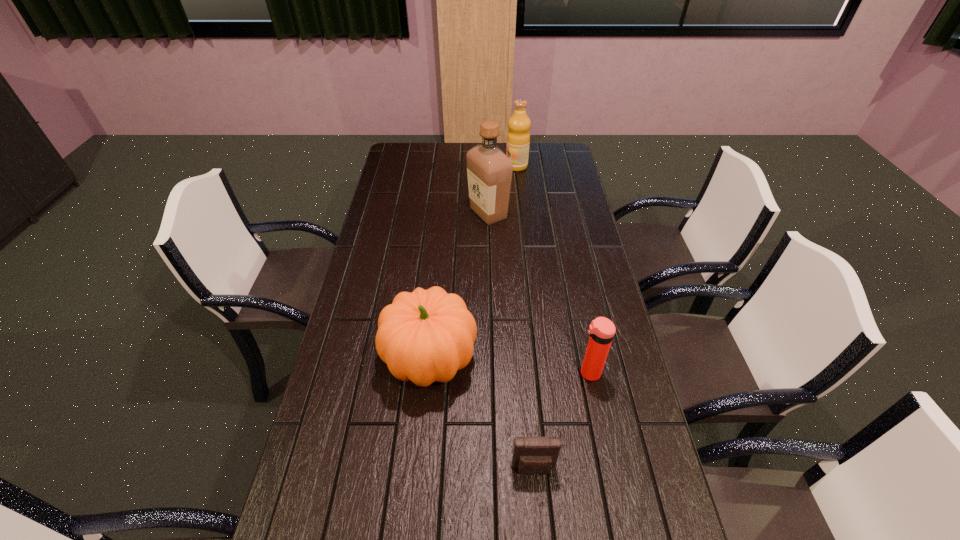
This screenshot has width=960, height=540. What are the coordinates of `object that is the closest one to the pumpkin` in the screenshot? It's located at (532, 455).

What are the coordinates of `the second closest object relative to the farthest object` in the screenshot? It's located at (425, 336).

Image resolution: width=960 pixels, height=540 pixels. I want to click on vacant space that satisfies the following two spatial constraints: 1. on the front-facing side of the liquor; 2. on the right side of the rightmost object, so click(492, 373).

Image resolution: width=960 pixels, height=540 pixels. I want to click on vacant region that satisfies the following two spatial constraints: 1. on the front label of the thermos bottle; 2. on the left side of the fruit juice, so click(540, 373).

The image size is (960, 540). Identify the location of free space that satisfies the following two spatial constraints: 1. on the front label of the farthest object; 2. with an open flap on the pouch. (550, 469).